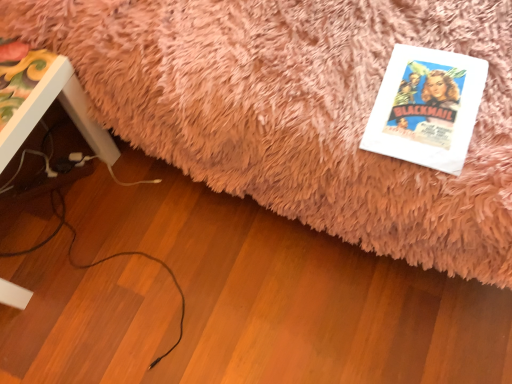
You are a GUI agent. You are given a task and a screenshot of the screen. Output one action in this format:
    pyautogui.click(x=<x>, y=<y>)
    Task: Click on the free point above white paper at lower right (from a real-world perspective)
    
    Given the screenshot: What is the action you would take?
    pyautogui.click(x=436, y=87)